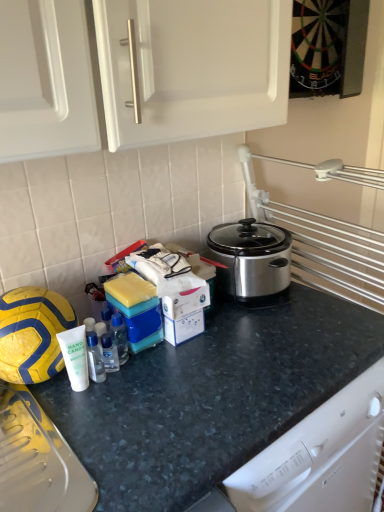
You are a GUI agent. You are given a task and a screenshot of the screen. Output one action in this format:
    pyautogui.click(x=<x>, y=<y>)
    Task: Click on the yellow matte football at left
    
    Given the screenshot: What is the action you would take?
    pyautogui.click(x=32, y=333)

Describe the element at coordinates (119, 337) in the screenshot. I see `transparent plastic bottle at center, the 2th bottle positioned from the left` at that location.

Where is `transparent plastic bottle at center, the 2th bottle positioned from the left`? Image resolution: width=384 pixels, height=512 pixels. transparent plastic bottle at center, the 2th bottle positioned from the left is located at coordinates (119, 337).

The image size is (384, 512). Find the location of `yellow matte football at left`. yellow matte football at left is located at coordinates (32, 333).

Between yellow matte football at left and clear plastic bottle at center, the 1th bottle in the left-to-right sequence, which one has smaller width?

clear plastic bottle at center, the 1th bottle in the left-to-right sequence.

From a real-world perspective, is yellow matte football at left located beneath clear plastic bottle at center, which appears as the 2th bottle when viewed from the back?

No, from a real-world perspective, yellow matte football at left is not under clear plastic bottle at center, which appears as the 2th bottle when viewed from the back.

Where is `the 1st bottle behind the yellow matte football at left, counting from the anchor's position`? The height and width of the screenshot is (512, 384). the 1st bottle behind the yellow matte football at left, counting from the anchor's position is located at coordinates (95, 358).

Identify the location of bottle that is the 1st object located above the dark gray granite countertop at center (from the image's perspective). Image resolution: width=384 pixels, height=512 pixels. (95, 358).

Is dark gray granite countertop at center in front of or behind clear plastic bottle at center, the 1th bottle from the front, in the image?

dark gray granite countertop at center is positioned closer to the viewer than clear plastic bottle at center, the 1th bottle from the front.

Can you tell me how much dark gray granite countertop at center and clear plastic bottle at center, which is the 2th bottle in right-to-left order, differ in facing direction?

The facing directions of dark gray granite countertop at center and clear plastic bottle at center, which is the 2th bottle in right-to-left order, are 8.85 degrees apart.

Looking at this image, does dark gray granite countertop at center appear on the left side of clear plastic bottle at center, which is the 2th bottle in right-to-left order?

No, dark gray granite countertop at center is not to the left of clear plastic bottle at center, which is the 2th bottle in right-to-left order.

Who is taller, clear plastic bottle at center, the 1th bottle in the left-to-right sequence, or dark gray granite countertop at center?

With more height is dark gray granite countertop at center.

Is clear plastic bottle at center, the 1th bottle from the front, to the left or to the right of dark gray granite countertop at center in the image?

clear plastic bottle at center, the 1th bottle from the front, is to the left of dark gray granite countertop at center.

Which object is more forward, clear plastic bottle at center, which is the 2th bottle in right-to-left order, or dark gray granite countertop at center?

Positioned in front is dark gray granite countertop at center.

From a real-world perspective, between clear plastic bottle at center, which appears as the 2th bottle when viewed from the back, and dark gray granite countertop at center, who is vertically lower?

dark gray granite countertop at center is physically lower.

From a real-world perspective, which is physically above, dark gray granite countertop at center or transparent plastic bottle at center, positioned as the 1th bottle in right-to-left order?

transparent plastic bottle at center, positioned as the 1th bottle in right-to-left order, is physically above.

How different are the orientations of dark gray granite countertop at center and transparent plastic bottle at center, the 2th bottle positioned from the left, in degrees?

The angle between the facing direction of dark gray granite countertop at center and the facing direction of transparent plastic bottle at center, the 2th bottle positioned from the left, is 8.85 degrees.

Considering the relative sizes of dark gray granite countertop at center and transparent plastic bottle at center, the 2th bottle positioned from the left, in the image provided, is dark gray granite countertop at center wider than transparent plastic bottle at center, the 2th bottle positioned from the left,?

Correct, the width of dark gray granite countertop at center exceeds that of transparent plastic bottle at center, the 2th bottle positioned from the left.

Is dark gray granite countertop at center not near transparent plastic bottle at center, positioned as the 1th bottle in right-to-left order?

That's not correct — dark gray granite countertop at center is a little close to transparent plastic bottle at center, positioned as the 1th bottle in right-to-left order.

Considering the points (87, 332) and (19, 310), which point is behind, point (87, 332) or point (19, 310)?

The point (87, 332) is farther from the camera.

From a real-world perspective, is clear plastic bottle at center, the 1th bottle from the front, physically above yellow matte football at left?

No.

From the image's perspective, is clear plastic bottle at center, which appears as the 2th bottle when viewed from the back, over yellow matte football at left?

No.

Looking at this image, is clear plastic bottle at center, the 1th bottle in the left-to-right sequence, far away from transparent plastic bottle at center, arranged as the 2th bottle when viewed from the front?

No, clear plastic bottle at center, the 1th bottle in the left-to-right sequence, is not far away from transparent plastic bottle at center, arranged as the 2th bottle when viewed from the front.

Considering their positions, is clear plastic bottle at center, which is the 2th bottle in right-to-left order, located in front of or behind transparent plastic bottle at center, arranged as the 2th bottle when viewed from the front?

clear plastic bottle at center, which is the 2th bottle in right-to-left order, is in front of transparent plastic bottle at center, arranged as the 2th bottle when viewed from the front.

Which of these two, clear plastic bottle at center, which is the 2th bottle in right-to-left order, or transparent plastic bottle at center, positioned as the 1th bottle in right-to-left order, is thinner?

transparent plastic bottle at center, positioned as the 1th bottle in right-to-left order.

From a real-world perspective, is clear plastic bottle at center, which is the 2th bottle in right-to-left order, physically below transparent plastic bottle at center, marked as the first bottle in a back-to-front arrangement?

Actually, clear plastic bottle at center, which is the 2th bottle in right-to-left order, is physically above transparent plastic bottle at center, marked as the first bottle in a back-to-front arrangement, in the real world.

From the image's perspective, between yellow matte football at left and dark gray granite countertop at center, who is located below?

dark gray granite countertop at center is shown below in the image.

How many degrees apart are the facing directions of yellow matte football at left and dark gray granite countertop at center?

There is a 2.48-degree angle between the facing directions of yellow matte football at left and dark gray granite countertop at center.

Considering the relative positions of yellow matte football at left and dark gray granite countertop at center in the image provided, is yellow matte football at left to the right of dark gray granite countertop at center from the viewer's perspective?

In fact, yellow matte football at left is to the left of dark gray granite countertop at center.

Is yellow matte football at left in contact with dark gray granite countertop at center?

There is a gap between yellow matte football at left and dark gray granite countertop at center.

Which bottle is the 1st one when counting from the right side of the yellow matte football at left? Please provide its 2D coordinates.

[(95, 358)]

Locate an element on the screen. bottle that is the 2nd object to the left of the dark gray granite countertop at center, starting at the anchor is located at coordinates (95, 358).

Based on their spatial positions, is yellow matte football at left or transparent plastic bottle at center, positioned as the 1th bottle in right-to-left order, closer to dark gray granite countertop at center?

Among the two, transparent plastic bottle at center, positioned as the 1th bottle in right-to-left order, is located nearer to dark gray granite countertop at center.

Based on their spatial positions, is dark gray granite countertop at center or transparent plastic bottle at center, the 2th bottle positioned from the left, closer to yellow matte football at left?

Among the two, transparent plastic bottle at center, the 2th bottle positioned from the left, is located nearer to yellow matte football at left.

Based on their spatial positions, is dark gray granite countertop at center or yellow matte football at left closer to transparent plastic bottle at center, marked as the first bottle in a back-to-front arrangement?

Based on the image, yellow matte football at left appears to be nearer to transparent plastic bottle at center, marked as the first bottle in a back-to-front arrangement.

Considering their positions, is clear plastic bottle at center, the 1th bottle from the front, positioned further to yellow matte football at left than transparent plastic bottle at center, the 2th bottle positioned from the left?

transparent plastic bottle at center, the 2th bottle positioned from the left.

From the image, which object appears to be nearer to yellow matte football at left, clear plastic bottle at center, which appears as the 2th bottle when viewed from the back, or dark gray granite countertop at center?

clear plastic bottle at center, which appears as the 2th bottle when viewed from the back.

When comparing their distances from clear plastic bottle at center, which appears as the 2th bottle when viewed from the back, does yellow matte football at left or transparent plastic bottle at center, marked as the first bottle in a back-to-front arrangement, seem further?

yellow matte football at left lies further to clear plastic bottle at center, which appears as the 2th bottle when viewed from the back, than the other object.

Based on their spatial positions, is yellow matte football at left or clear plastic bottle at center, which is the 2th bottle in right-to-left order, closer to transparent plastic bottle at center, the 2th bottle positioned from the left?

Among the two, clear plastic bottle at center, which is the 2th bottle in right-to-left order, is located nearer to transparent plastic bottle at center, the 2th bottle positioned from the left.

Looking at the image, which one is located further to dark gray granite countertop at center, clear plastic bottle at center, the 1th bottle in the left-to-right sequence, or transparent plastic bottle at center, marked as the first bottle in a back-to-front arrangement?

Among the two, clear plastic bottle at center, the 1th bottle in the left-to-right sequence, is located further to dark gray granite countertop at center.

At what (x,y) coordinates should I click in order to perform the action: click on bottle between transparent plastic bottle at center, marked as the first bottle in a back-to-front arrangement, and dark gray granite countertop at center from top to bottom. Please return your answer as a coordinate pair (x, y). The width and height of the screenshot is (384, 512). Looking at the image, I should click on (95, 358).

Image resolution: width=384 pixels, height=512 pixels. Identify the location of bottle situated between yellow matte football at left and transparent plastic bottle at center, positioned as the 1th bottle in right-to-left order, from left to right. (95, 358).